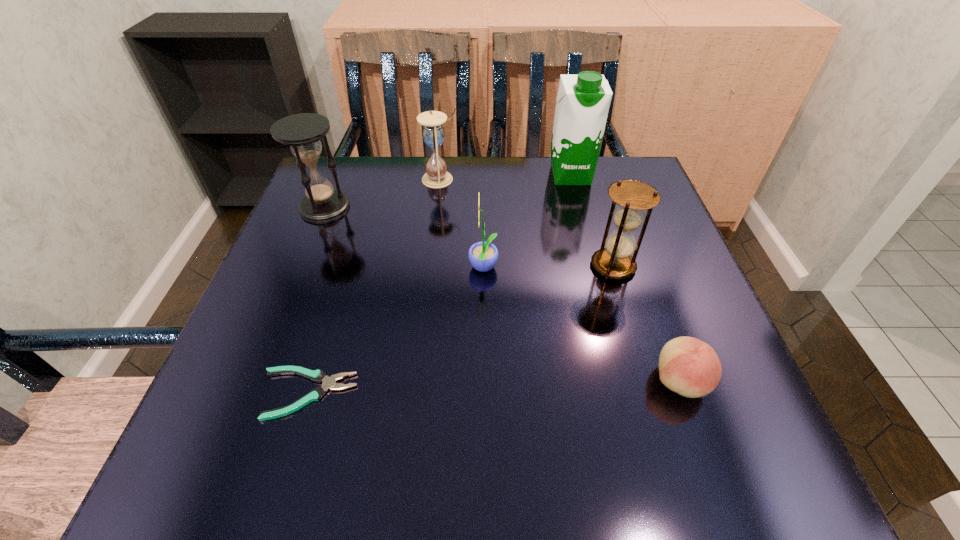
The width and height of the screenshot is (960, 540). What are the coordinates of `vacant space that satisfies the following two spatial constraints: 1. on the back side of the shortest object; 2. on the left side of the peach` in the screenshot? It's located at (311, 381).

Find the location of a particular element. vacant point that satisfies the following two spatial constraints: 1. on the front-facing side of the tallest object; 2. on the front-facing side of the fourth object from right to left is located at coordinates (594, 269).

Identify the location of free point that satisfies the following two spatial constraints: 1. on the front-facing side of the tallest object; 2. on the right side of the second shortest object. The width and height of the screenshot is (960, 540). (623, 381).

Where is `vacant region that satisfies the following two spatial constraints: 1. on the front-facing side of the tallest object; 2. on the front-facing side of the fourth object from left to right`? vacant region that satisfies the following two spatial constraints: 1. on the front-facing side of the tallest object; 2. on the front-facing side of the fourth object from left to right is located at coordinates (594, 269).

Locate an element on the screen. The image size is (960, 540). vacant space that satisfies the following two spatial constraints: 1. on the front-facing side of the tallest object; 2. on the front-facing side of the fourth object from left to right is located at coordinates (594, 269).

I want to click on free location that satisfies the following two spatial constraints: 1. on the front-facing side of the soya milk; 2. on the front-facing side of the fourth object from right to left, so click(x=594, y=269).